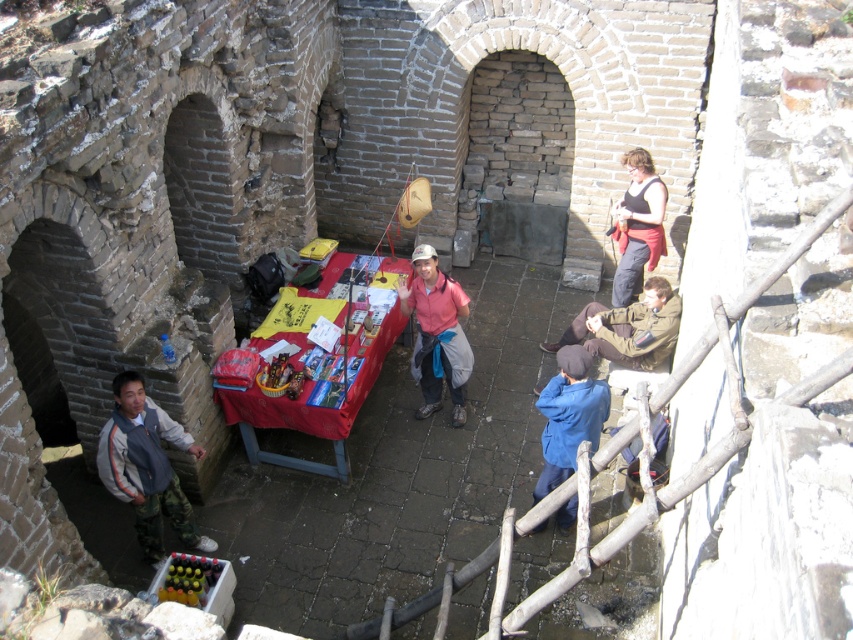
You are a tourist who wants to buy a souvenir that fits into your backpack. You see the matte pink shirt at center and the camouflage pants at lower right at the stall. Based on their sizes, which one is more likely to fit in your backpack without folding?

The matte pink shirt at center has a smaller width than the camouflage pants at lower right, so it is more likely to fit in your backpack without folding.

You are a tourist visiting this historical site and want to buy a souvenir. You see the matte pink shirt at center and the blue fabric jacket at lower right on the table. Which item is larger in size?

The matte pink shirt at center is bigger than the blue fabric jacket at lower right.